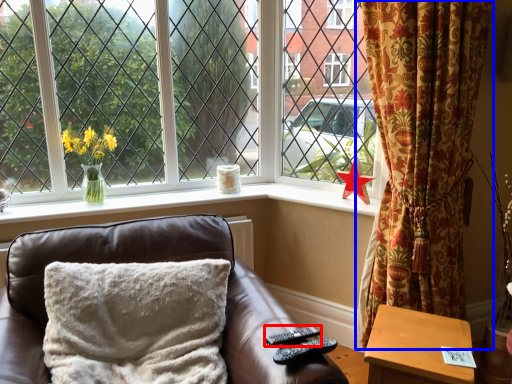
Question: Which of the following is the farthest to the observer, remote (highlighted by a red box) or curtain (highlighted by a blue box)?

Choices:
 (A) remote
 (B) curtain

Answer: (B)